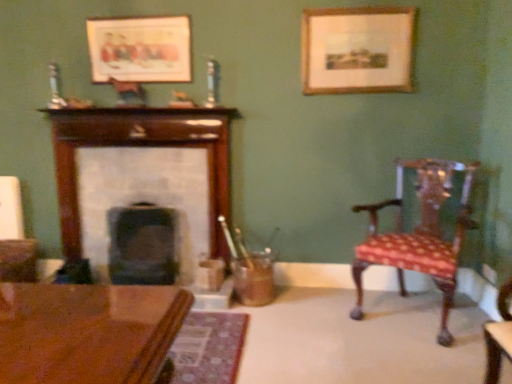
Question: From a real-world perspective, is wooden picture frame at upper center, marked as the 1th picture frame in a left-to-right arrangement, physically below polished wood chair at right?

Choices:
 (A) yes
 (B) no

Answer: (B)

Question: Does wooden picture frame at upper center, marked as the 1th picture frame in a left-to-right arrangement, have a smaller size compared to polished wood chair at right?

Choices:
 (A) no
 (B) yes

Answer: (B)

Question: Does wooden picture frame at upper center, marked as the 1th picture frame in a left-to-right arrangement, have a greater width compared to polished wood chair at right?

Choices:
 (A) no
 (B) yes

Answer: (A)

Question: From the image's perspective, would you say wooden picture frame at upper center, placed as the second picture frame when sorted from right to left, is shown under polished wood chair at right?

Choices:
 (A) yes
 (B) no

Answer: (B)

Question: Is wooden picture frame at upper center, marked as the 1th picture frame in a left-to-right arrangement, in front of polished wood chair at right?

Choices:
 (A) no
 (B) yes

Answer: (A)

Question: Which is correct: polished wood chair at right is inside wooden picture frame at upper center, placed as the second picture frame when sorted from right to left, or outside of it?

Choices:
 (A) outside
 (B) inside

Answer: (A)

Question: In terms of size, does polished wood chair at right appear bigger or smaller than wooden picture frame at upper center, marked as the 1th picture frame in a left-to-right arrangement?

Choices:
 (A) small
 (B) big

Answer: (B)

Question: In terms of height, does polished wood chair at right look taller or shorter compared to wooden picture frame at upper center, placed as the second picture frame when sorted from right to left?

Choices:
 (A) tall
 (B) short

Answer: (A)

Question: From the image's perspective, is polished wood chair at right above or below wooden picture frame at upper center, placed as the second picture frame when sorted from right to left?

Choices:
 (A) above
 (B) below

Answer: (B)

Question: In the image, is smooth dark wood fireplace at center, the first fireplace in the right-to-left sequence, positioned in front of or behind wooden picture frame at upper right, the 2th picture frame when ordered from left to right?

Choices:
 (A) front
 (B) behind

Answer: (B)

Question: Is point (131, 236) positioned closer to the camera than point (355, 8)?

Choices:
 (A) closer
 (B) farther

Answer: (B)

Question: Is smooth dark wood fireplace at center, the first fireplace in the right-to-left sequence, wider or thinner than wooden picture frame at upper right, which ranks as the 1th picture frame in right-to-left order?

Choices:
 (A) wide
 (B) thin

Answer: (A)

Question: Is smooth dark wood fireplace at center, the second fireplace from the left, taller or shorter than wooden picture frame at upper right, which ranks as the 1th picture frame in right-to-left order?

Choices:
 (A) tall
 (B) short

Answer: (A)

Question: In the image, is polished wood chair at right positioned in front of or behind wooden fireplace at center, placed as the 1th fireplace when sorted from left to right?

Choices:
 (A) behind
 (B) front

Answer: (B)

Question: From the image's perspective, is polished wood chair at right above or below wooden fireplace at center, placed as the 1th fireplace when sorted from left to right?

Choices:
 (A) above
 (B) below

Answer: (B)